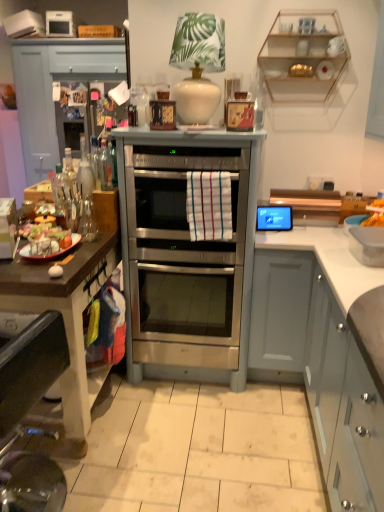
Locate an element on the screen. vacant space in front of white matte cabinet at center, which ranks as the 2th cabinetry in bottom-to-top order is located at coordinates (268, 410).